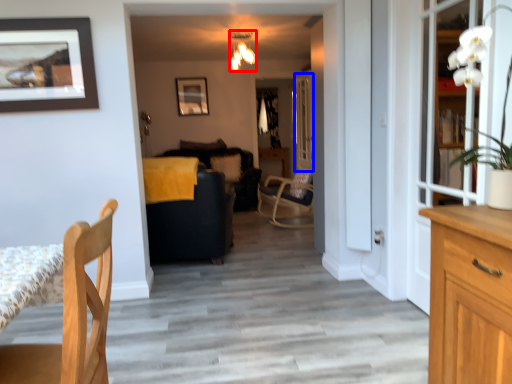
Question: Which object is closer to the camera taking this photo, lamp (highlighted by a red box) or glass door (highlighted by a blue box)?

Choices:
 (A) lamp
 (B) glass door

Answer: (A)